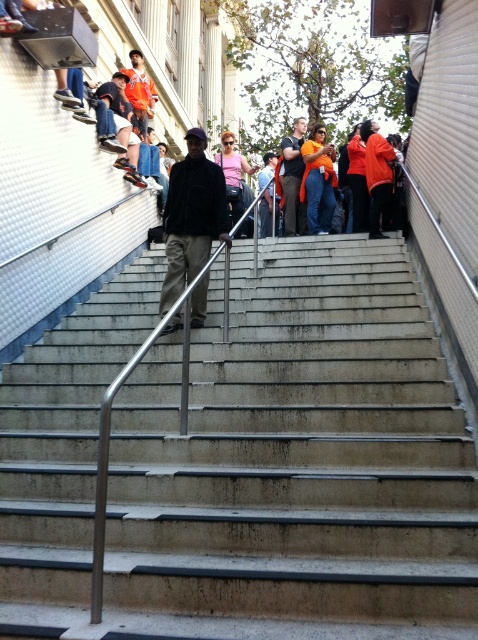
Question: Which object is closer to the camera taking this photo?

Choices:
 (A) orange fabric shirt at upper center
 (B) dark brown leather jacket at center
 (C) concrete stairs at center

Answer: (C)

Question: Which point appears closest to the camera in this image?

Choices:
 (A) (471, 618)
 (B) (176, 186)
 (C) (328, 205)

Answer: (A)

Question: Does concrete stairs at center have a larger size compared to dark brown leather jacket at center?

Choices:
 (A) no
 (B) yes

Answer: (B)

Question: Can you confirm if orange fabric shirt at upper center is thinner than orange shirt at center?

Choices:
 (A) yes
 (B) no

Answer: (B)

Question: Which object appears closest to the camera in this image?

Choices:
 (A) orange fabric shirt at upper center
 (B) dark brown leather jacket at center
 (C) concrete stairs at center
 (D) orange shirt at center

Answer: (C)

Question: Is dark brown leather jacket at center bigger than orange fabric shirt at upper center?

Choices:
 (A) yes
 (B) no

Answer: (A)